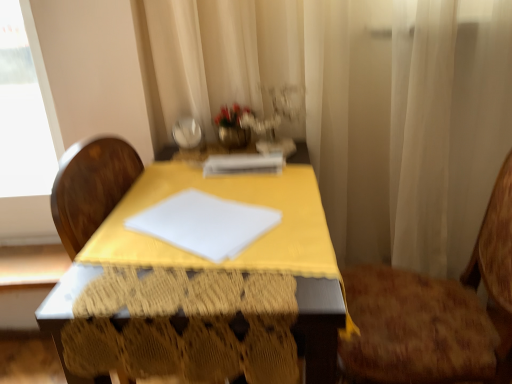
Find the location of `white paper at center`. white paper at center is located at coordinates (243, 164).

Where is `brown textured chair at right`? brown textured chair at right is located at coordinates (437, 313).

Is yellow fabric-covered table at center facing towards white sheer curtain at center?

No, yellow fabric-covered table at center is not facing towards white sheer curtain at center.

Does point (304, 293) come behind point (466, 258)?

That is False.

Between yellow fabric-covered table at center and white sheer curtain at center, which one has less height?

yellow fabric-covered table at center is shorter.

Is yellow fabric-covered table at center not inside white sheer curtain at center?

Yes, yellow fabric-covered table at center is not within white sheer curtain at center.

Which of these two, white paper at center or brown textured chair at right, is thinner?

With smaller width is white paper at center.

Is white paper at center closer to the viewer compared to brown textured chair at right?

No.

From the image's perspective, is white paper at center on top of brown textured chair at right?

Yes, from the image's perspective, white paper at center is over brown textured chair at right.

Looking at their sizes, would you say yellow fabric-covered table at center is wider or thinner than brown textured chair at right?

In the image, yellow fabric-covered table at center appears to be wider than brown textured chair at right.

From the image's perspective, would you say yellow fabric-covered table at center is positioned over brown textured chair at right?

Yes.

Who is taller, yellow fabric-covered table at center or brown textured chair at right?

With more height is brown textured chair at right.

Is yellow fabric-covered table at center oriented away from brown textured chair at right?

yellow fabric-covered table at center is not turned away from brown textured chair at right.

In the scene shown: How different are the orientations of white paper at center and yellow fabric-covered table at center in degrees?

The angular difference between white paper at center and yellow fabric-covered table at center is 4.47 degrees.

Is white paper at center smaller than yellow fabric-covered table at center?

Correct, white paper at center occupies less space than yellow fabric-covered table at center.

Is white paper at center facing away from yellow fabric-covered table at center?

Yes, white paper at center is positioned with its back facing yellow fabric-covered table at center.

Is white paper at center positioned behind yellow fabric-covered table at center?

Yes, white paper at center is further from the viewer.

Considering the relative sizes of yellow fabric-covered table at center and white paper at center in the image provided, is yellow fabric-covered table at center taller than white paper at center?

Correct, yellow fabric-covered table at center is much taller as white paper at center.

At what (x,y) coordinates should I click in order to perform the action: click on table below the white paper at center (from the image's perspective). Please return your answer as a coordinate pair (x, y). The height and width of the screenshot is (384, 512). Looking at the image, I should click on (91, 187).

Is yellow fabric-covered table at center not within white paper at center?

Yes, yellow fabric-covered table at center is not within white paper at center.

Considering the positions of points (447, 87) and (213, 163), is point (447, 87) farther from camera compared to point (213, 163)?

Yes.

Which is correct: white sheer curtain at center is inside white paper at center, or outside of it?

white sheer curtain at center exists outside the volume of white paper at center.

Based on the photo, considering the sizes of objects white sheer curtain at center and white paper at center in the image provided, who is thinner, white sheer curtain at center or white paper at center?

white paper at center is thinner.

Which is more to the left, white paper at center or white sheer curtain at center?

white paper at center is more to the left.

The width and height of the screenshot is (512, 384). I want to click on curtain that appears below the white paper at center (from the image's perspective), so click(408, 127).

Is there a large distance between white paper at center and white sheer curtain at center?

white paper at center is actually quite close to white sheer curtain at center.

Is white paper at center bigger or smaller than white sheer curtain at center?

In the image, white paper at center appears to be smaller than white sheer curtain at center.

You are a GUI agent. You are given a task and a screenshot of the screen. Output one action in this format:
    pyautogui.click(x=<x>, y=<y>)
    Task: Click on the table in front of the white sheer curtain at center
    Image resolution: width=512 pixels, height=384 pixels.
    Given the screenshot: What is the action you would take?
    pyautogui.click(x=91, y=187)

Identify the location of notebook above the brown textured chair at right (from the image's perspective). Image resolution: width=512 pixels, height=384 pixels. (243, 164).

Looking at the image, which one is located closer to brown textured chair at right, white sheer curtain at center or yellow fabric-covered table at center?

white sheer curtain at center lies closer to brown textured chair at right than the other object.

From the image, which object appears to be nearer to white paper at center, yellow fabric-covered table at center or brown textured chair at right?

Among the two, yellow fabric-covered table at center is located nearer to white paper at center.

Consider the image. Which object lies further to the anchor point brown textured chair at right, white sheer curtain at center or white paper at center?

white paper at center is further to brown textured chair at right.

Which object lies nearer to the anchor point white paper at center, brown textured chair at right or white sheer curtain at center?

white sheer curtain at center is positioned closer to the anchor white paper at center.

Estimate the real-world distances between objects in this image. Which object is further from yellow fabric-covered table at center, white sheer curtain at center or white paper at center?

The object further to yellow fabric-covered table at center is white sheer curtain at center.

Consider the image. Looking at the image, which one is located further to yellow fabric-covered table at center, white sheer curtain at center or brown textured chair at right?

Based on the image, brown textured chair at right appears to be further to yellow fabric-covered table at center.

Based on their spatial positions, is white sheer curtain at center or brown textured chair at right further from white paper at center?

brown textured chair at right lies further to white paper at center than the other object.

Considering their positions, is white paper at center positioned closer to white sheer curtain at center than yellow fabric-covered table at center?

The object closer to white sheer curtain at center is yellow fabric-covered table at center.

Identify the location of curtain between yellow fabric-covered table at center and brown textured chair at right. The width and height of the screenshot is (512, 384). (408, 127).

Where is `curtain between white paper at center and brown textured chair at right in the horizontal direction`? The width and height of the screenshot is (512, 384). curtain between white paper at center and brown textured chair at right in the horizontal direction is located at coordinates (408, 127).

Identify the location of notebook between yellow fabric-covered table at center and brown textured chair at right. (243, 164).

Identify the location of curtain between yellow fabric-covered table at center and white paper at center in the front-back direction. (408, 127).